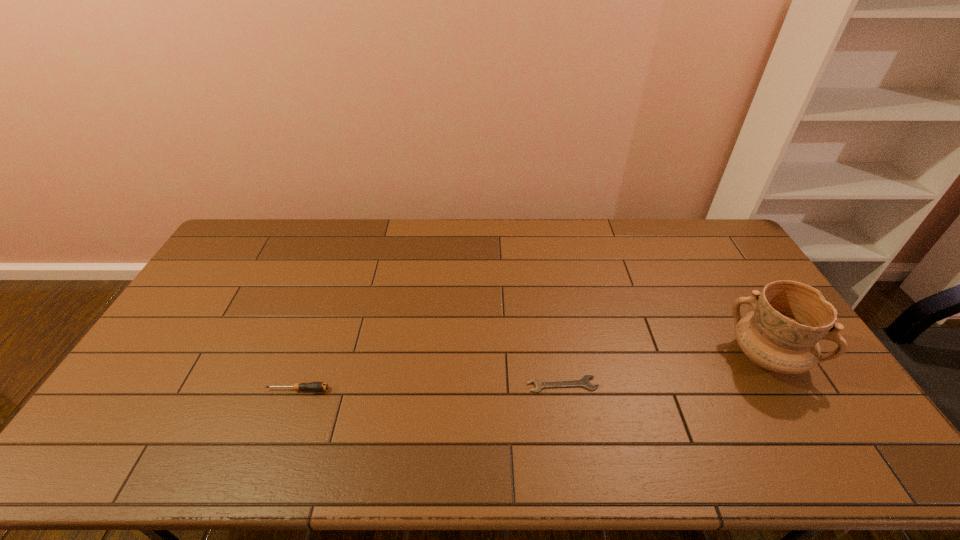
Find the location of `the rightmost object`. the rightmost object is located at coordinates (782, 333).

At what (x,y) coordinates should I click in order to perform the action: click on the tallest object. Please return your answer as a coordinate pair (x, y). Looking at the image, I should click on (782, 333).

This screenshot has width=960, height=540. What are the coordinates of `the second tallest object` in the screenshot? It's located at (313, 386).

This screenshot has width=960, height=540. What are the coordinates of `the leftmost object` in the screenshot? It's located at (313, 386).

Locate an element on the screen. Image resolution: width=960 pixels, height=540 pixels. the shortest object is located at coordinates (584, 381).

This screenshot has height=540, width=960. Find the location of `the second object from right to left`. the second object from right to left is located at coordinates (584, 381).

The image size is (960, 540). Find the location of `blank space located on the back of the tallest object`. blank space located on the back of the tallest object is located at coordinates point(726,288).

Where is `free space located 0.160m on the front of the screwdriver`? free space located 0.160m on the front of the screwdriver is located at coordinates (276, 451).

The image size is (960, 540). I want to click on vacant space located on the right of the second object from left to right, so click(x=679, y=384).

Identify the location of object located at the right edge. This screenshot has height=540, width=960. (782, 333).